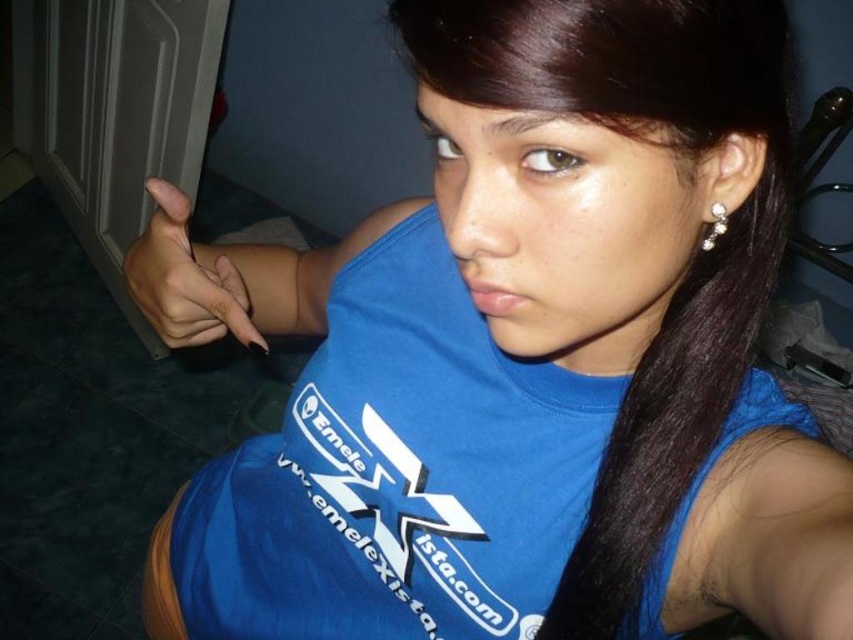
Question: Can you confirm if nail polish at center is wider than pearl shiny earrings at upper right?

Choices:
 (A) no
 (B) yes

Answer: (B)

Question: Which point is farther to the camera?

Choices:
 (A) (210, 276)
 (B) (717, 240)

Answer: (A)

Question: Is nail polish at center below pearl shiny earrings at upper right?

Choices:
 (A) no
 (B) yes

Answer: (B)

Question: Is nail polish at center further to the viewer compared to pearl shiny earrings at upper right?

Choices:
 (A) no
 (B) yes

Answer: (B)